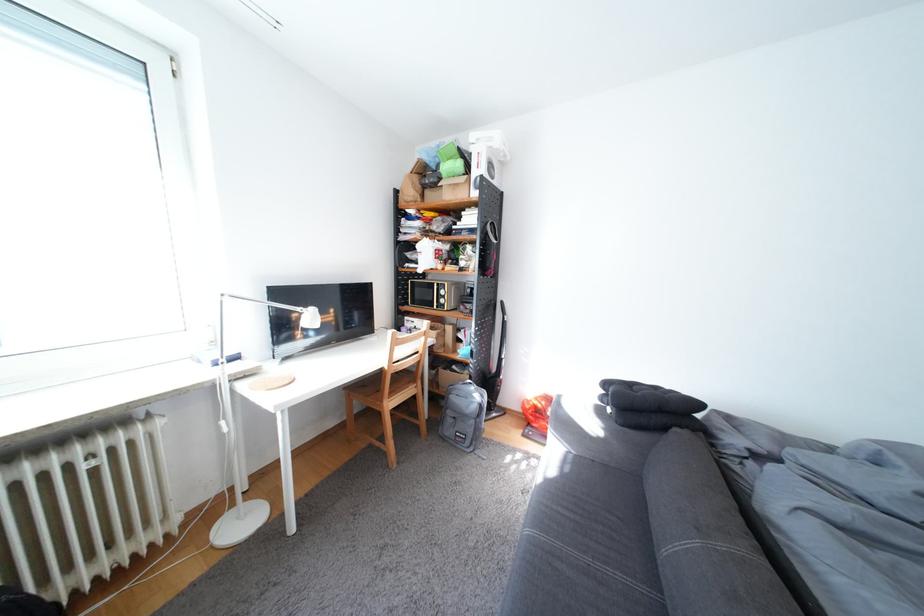
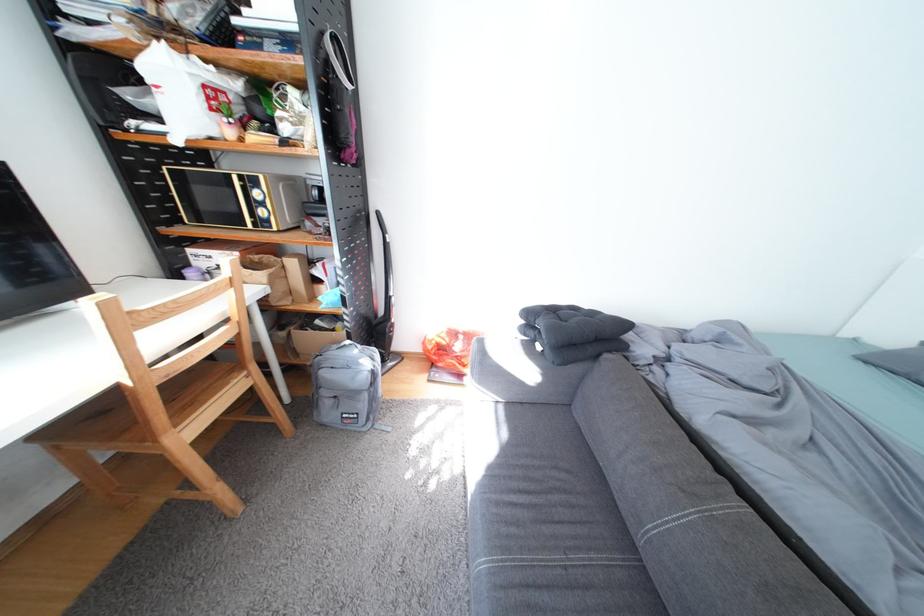
Question: I am providing you with two images of the same scene from different viewpoints. Please identify which objects are invisible in image2.

Choices:
 (A) grey sofa sitting surface
 (B) brown paper bag
 (C) black tufted cushion
 (D) none of these

Answer: (D)